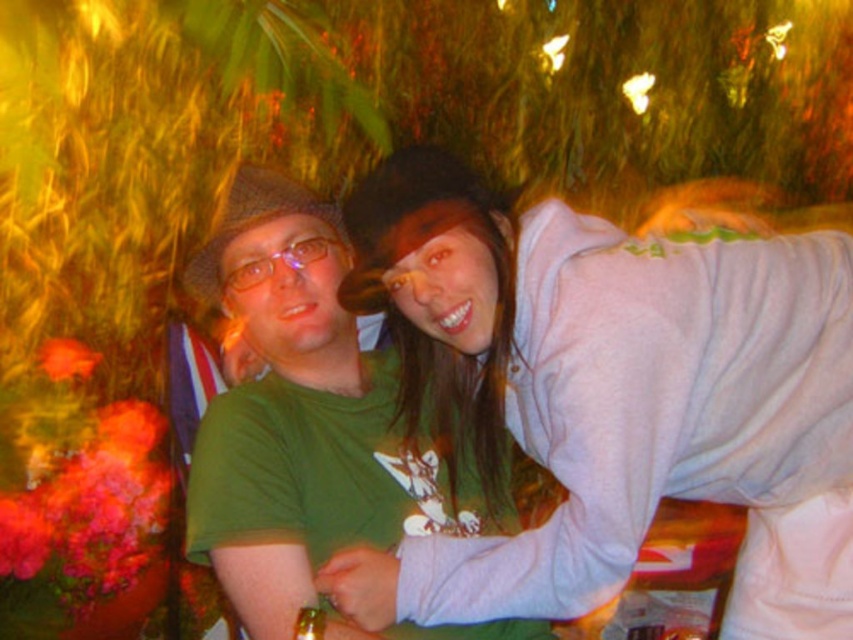
You are standing at the origin point in the image. A white soft sweatshirt at upper right is located at point [614,397]. Which direction should you move to reach it?

To reach the white soft sweatshirt at upper right located at point [614,397] from the origin, move towards the upper right direction.

You are a photographer trying to adjust the lighting for a photo shoot. You notice the white soft sweatshirt at upper right and the green matte shirt at center. Which clothing item is closer to the camera?

The white soft sweatshirt at upper right is positioned over the green matte shirt at center, so it is closer to the camera.

You are trying to decide which person to approach for a group photo. The scene has a festive atmosphere with warm lighting and blurred greenery in the background. You see the white soft sweatshirt at upper right and the green matte shirt at center. Which person is shorter?

The white soft sweatshirt at upper right is not as tall as the green matte shirt at center, so the person wearing the white soft sweatshirt at upper right is shorter.